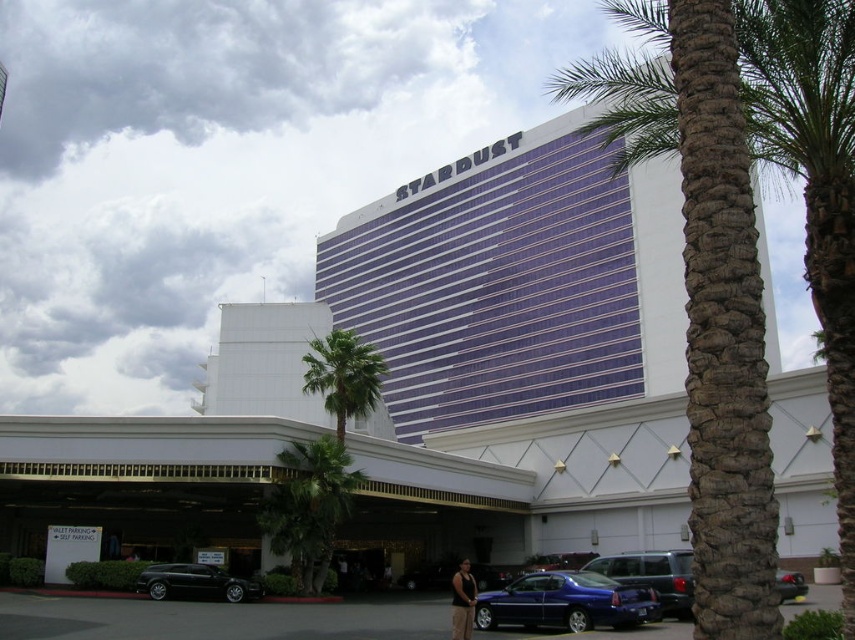
Question: Does metallic blue sedan at center appear under shiny black sedan at lower left?

Choices:
 (A) yes
 (B) no

Answer: (A)

Question: Is metallic blue sedan at center wider than matte black suv at lower right?

Choices:
 (A) yes
 (B) no

Answer: (B)

Question: Among these objects, which one is farthest from the camera?

Choices:
 (A) shiny black car at lower right
 (B) metallic blue sedan at center
 (C) shiny black sedan at lower left
 (D) green leafy palm tree at lower center

Answer: (D)

Question: Estimate the real-world distances between objects in this image. Which object is farther from the dark gray tank top at lower center?

Choices:
 (A) green leafy palm tree at lower center
 (B) brown textured palm tree at right
 (C) matte black suv at lower right
 (D) shiny black sedan at lower left

Answer: (B)

Question: Among these objects, which one is nearest to the camera?

Choices:
 (A) green leafy palm tree at lower center
 (B) metallic blue sedan at center
 (C) shiny black car at lower right

Answer: (C)

Question: Does metallic blue sedan at center appear over matte black suv at lower right?

Choices:
 (A) yes
 (B) no

Answer: (B)